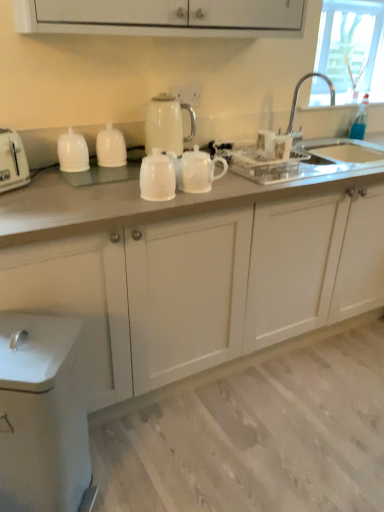
Find the location of a particular element. This screenshot has width=384, height=512. vacant area that lies to the right of white plastic toaster at left is located at coordinates 54,186.